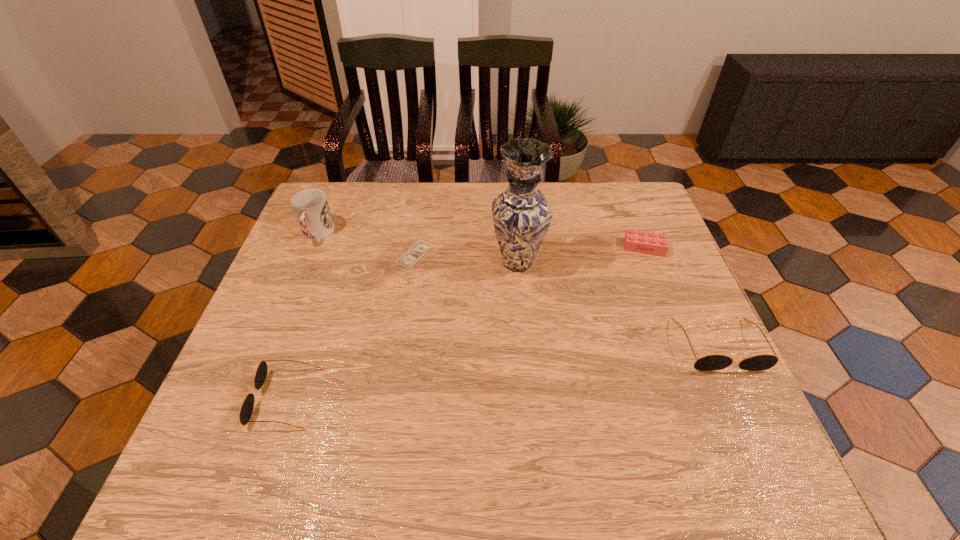
At what (x,y) coordinates should I click in order to perform the action: click on free area in between the third object from left to right and the fourth tallest object. Please return your answer as a coordinate pair (x, y). Looking at the image, I should click on (350, 326).

I want to click on vacant space that is in between the fourth shortest object and the third object from right to left, so click(617, 303).

Where is `free spot between the taller sunglasses and the fourth object from left to right`? This screenshot has width=960, height=540. free spot between the taller sunglasses and the fourth object from left to right is located at coordinates (617, 303).

Locate an element on the screen. The width and height of the screenshot is (960, 540). blank region between the cup and the shortest object is located at coordinates (366, 244).

Image resolution: width=960 pixels, height=540 pixels. Find the location of `free area in between the second tallest object and the shorter sunglasses`. free area in between the second tallest object and the shorter sunglasses is located at coordinates (300, 316).

Find the location of a particular element. unoccupied area between the Lego and the fourth shortest object is located at coordinates (682, 296).

This screenshot has width=960, height=540. Identify the location of vacant space that's between the shorter sunglasses and the cup. (300, 316).

The image size is (960, 540). In order to click on vacant space in between the Lego and the second tallest object in this screenshot , I will do `click(480, 240)`.

Point out which object is positioned as the third nearest to the money. Please provide its 2D coordinates. Your answer should be formatted as a tuple, i.e. [(x, y)], where the tuple contains the x and y coordinates of a point satisfying the conditions above.

[(246, 410)]

Choose which object is the second nearest neighbor to the cup. Please provide its 2D coordinates. Your answer should be formatted as a tuple, i.e. [(x, y)], where the tuple contains the x and y coordinates of a point satisfying the conditions above.

[(246, 410)]